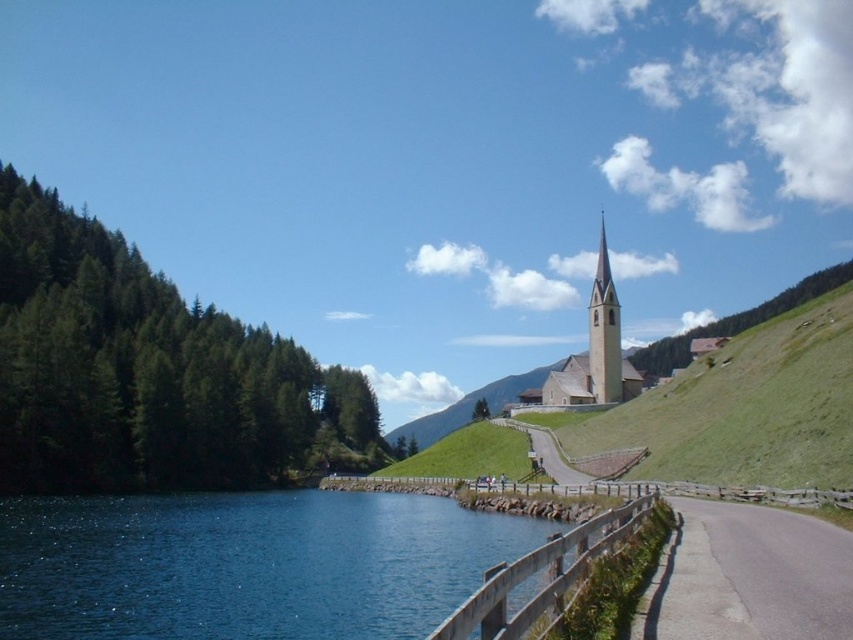
Is blue water at lower left wider than smooth beige steeple at upper center?

Correct, the width of blue water at lower left exceeds that of smooth beige steeple at upper center.

Can you confirm if blue water at lower left is positioned to the right of smooth beige steeple at upper center?

In fact, blue water at lower left is to the left of smooth beige steeple at upper center.

The width and height of the screenshot is (853, 640). In order to click on blue water at lower left in this screenshot , I will do `click(247, 564)`.

Does blue water at lower left appear over smooth beige church at center?

No.

Does blue water at lower left have a lesser width compared to smooth beige church at center?

No.

The width and height of the screenshot is (853, 640). I want to click on blue water at lower left, so click(x=247, y=564).

Locate an element on the screen. blue water at lower left is located at coordinates (247, 564).

From the picture: Who is more distant from viewer, (592,387) or (595,324)?

The point (595,324) is behind.

Who is taller, smooth beige church at center or smooth beige steeple at upper center?

smooth beige church at center is taller.

What do you see at coordinates (596, 349) in the screenshot? Image resolution: width=853 pixels, height=640 pixels. I see `smooth beige church at center` at bounding box center [596, 349].

This screenshot has width=853, height=640. In order to click on smooth beige church at center in this screenshot , I will do `click(596, 349)`.